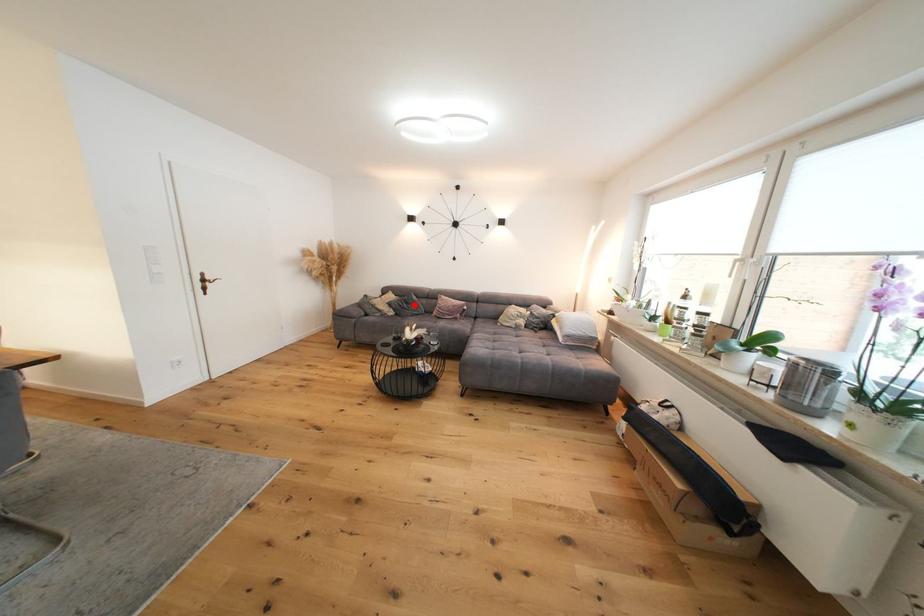
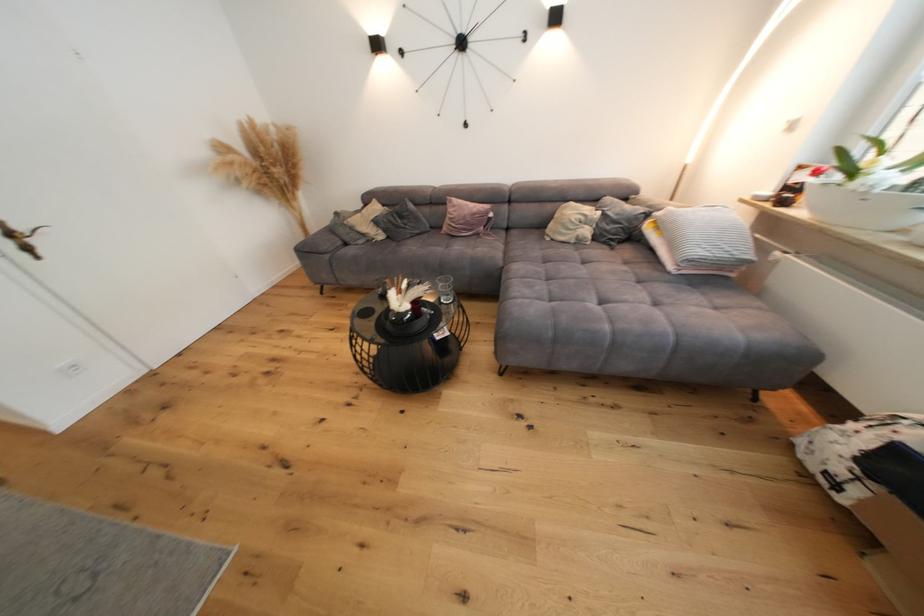
Question: I am providing you with two images of the same scene from different viewpoints. A red point is marked on the first image. Is the red point's position out of view in image 2?

Choices:
 (A) Yes
 (B) No

Answer: (B)